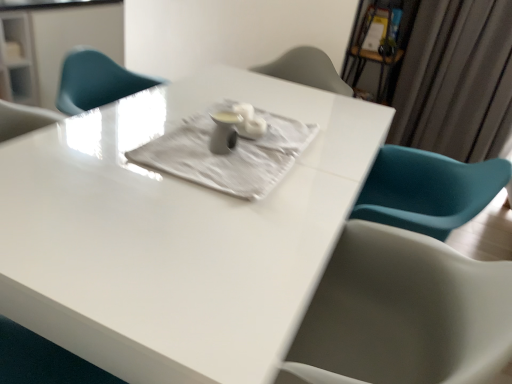
Question: Is white textured cloth at center in front of or behind white glossy table at center in the image?

Choices:
 (A) front
 (B) behind

Answer: (B)

Question: From a real-world perspective, relative to white glossy table at center, is white textured cloth at center vertically above or below?

Choices:
 (A) below
 (B) above

Answer: (B)

Question: Which of these objects is positioned closest to the white textured cloth at center?

Choices:
 (A) white glossy table at center
 (B) silky gray curtain at upper right

Answer: (A)

Question: Which of these objects is positioned farthest from the silky gray curtain at upper right?

Choices:
 (A) white textured cloth at center
 (B) white glossy table at center

Answer: (A)